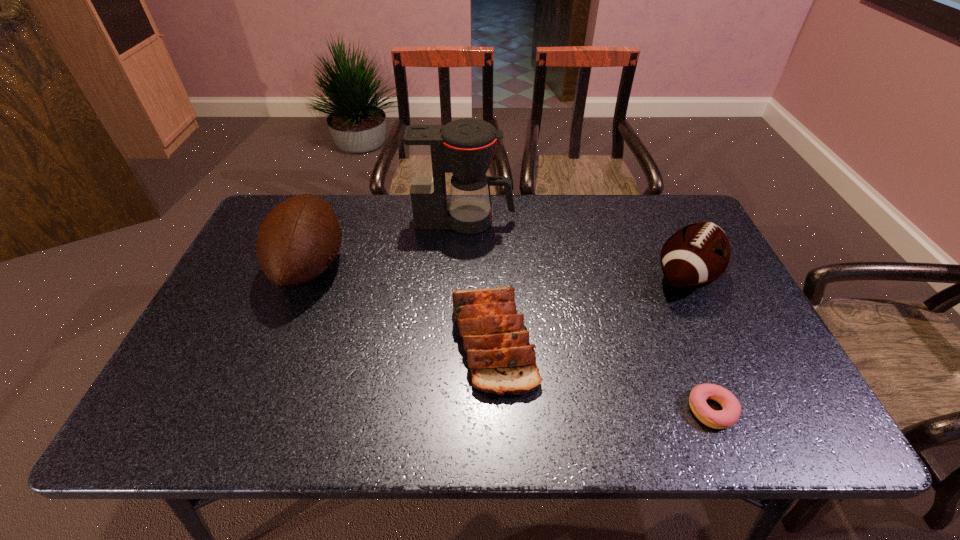
I want to click on vacant region that satisfies the following two spatial constraints: 1. pour from the carafe of the coffee maker; 2. on the right side of the right football (American), so click(x=463, y=277).

Where is `vacant point that satisfies the following two spatial constraints: 1. pour from the carafe of the tallest object; 2. on the left side of the doughnut`? This screenshot has width=960, height=540. vacant point that satisfies the following two spatial constraints: 1. pour from the carafe of the tallest object; 2. on the left side of the doughnut is located at coordinates (458, 410).

The image size is (960, 540). What are the coordinates of `vacant area in the image that satisfies the following two spatial constraints: 1. pour from the carafe of the tallest object; 2. on the right side of the doughnut` in the screenshot? It's located at (458, 410).

Where is `free location that satisfies the following two spatial constraints: 1. on the back side of the right football (American); 2. pour from the carafe of the coffee maker`? Image resolution: width=960 pixels, height=540 pixels. free location that satisfies the following two spatial constraints: 1. on the back side of the right football (American); 2. pour from the carafe of the coffee maker is located at coordinates (660, 221).

Locate an element on the screen. This screenshot has height=540, width=960. vacant region that satisfies the following two spatial constraints: 1. pour from the carafe of the tallest object; 2. on the left side of the bread is located at coordinates (460, 340).